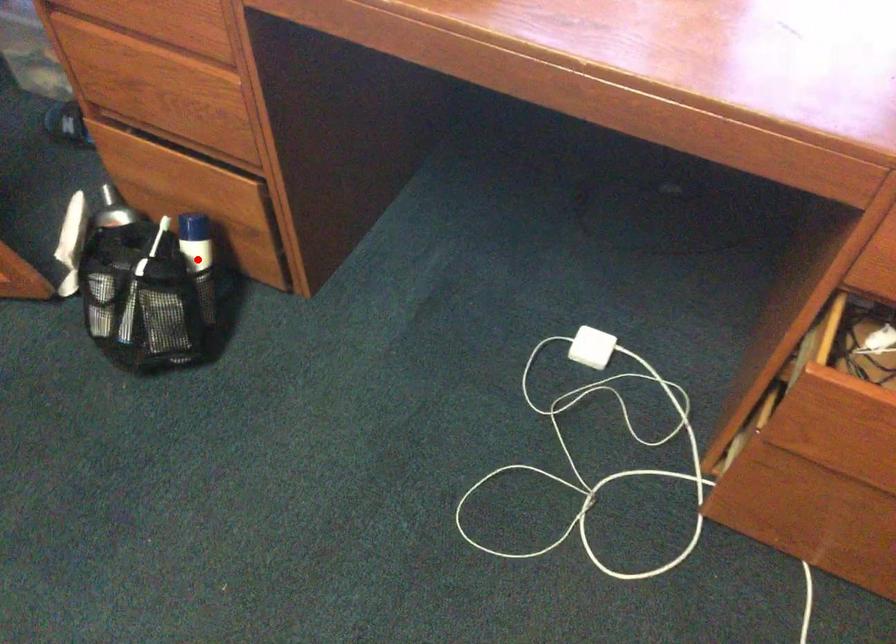
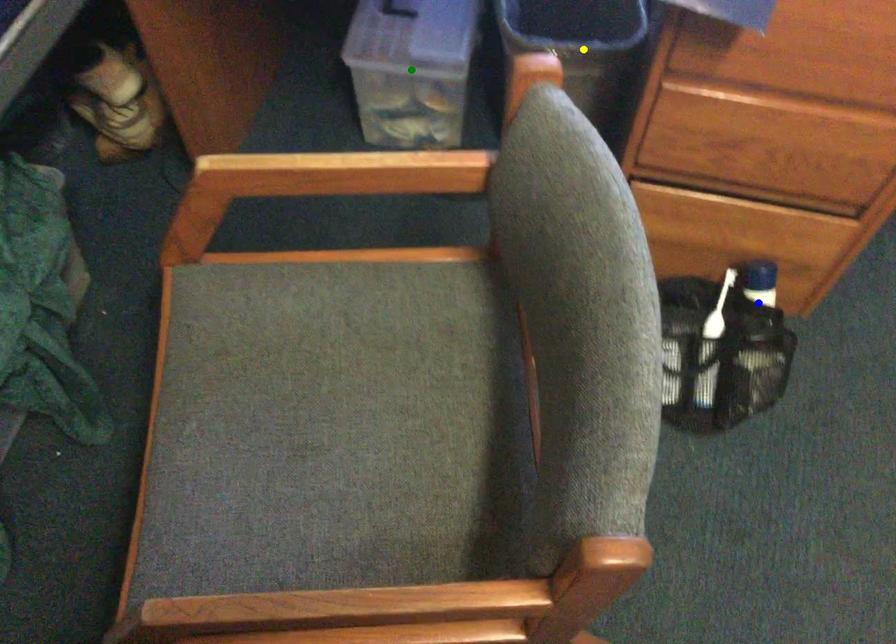
Question: I am providing you with two images of the same scene from different viewpoints. A red point is marked on the first image. You are given multiple points on the second image. Which point in image 2 is actually the same real-world point as the red point in image 1?

Choices:
 (A) green point
 (B) blue point
 (C) yellow point

Answer: (B)